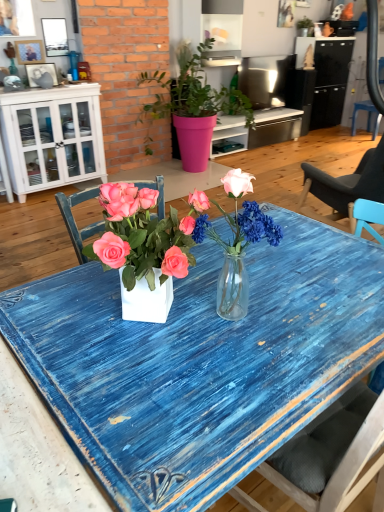
Describe the element at coordinates (193, 105) in the screenshot. I see `pink matte pot at center, which ranks as the 1th houseplant in front-to-back order` at that location.

Measure the distance between point (x=24, y=52) and camera.

Point (x=24, y=52) is 3.58 meters away from camera.

The height and width of the screenshot is (512, 384). What are the coordinates of `brushed metal picture frame at upper left, which is the third picture frame from bottom to top` in the screenshot? It's located at (55, 36).

The width and height of the screenshot is (384, 512). In order to click on blue plastic chair at right in this screenshot , I will do `click(367, 117)`.

From a real-world perspective, which is physically above, pink matte pot at center, which ranks as the 1th houseplant in front-to-back order, or green matte plant at upper center, placed as the first houseplant when sorted from right to left?

green matte plant at upper center, placed as the first houseplant when sorted from right to left, is physically above.

Is there a large distance between pink matte pot at center, the 2th houseplant when ordered from right to left, and green matte plant at upper center, which appears as the second houseplant when viewed from the front?

pink matte pot at center, the 2th houseplant when ordered from right to left, is positioned a significant distance from green matte plant at upper center, which appears as the second houseplant when viewed from the front.

Considering the sizes of objects pink matte pot at center, which ranks as the 1th houseplant in front-to-back order, and green matte plant at upper center, which ranks as the 1th houseplant in top-to-bottom order, in the image provided, who is wider, pink matte pot at center, which ranks as the 1th houseplant in front-to-back order, or green matte plant at upper center, which ranks as the 1th houseplant in top-to-bottom order,?

pink matte pot at center, which ranks as the 1th houseplant in front-to-back order, is wider.

Is matte black picture frame at upper left, acting as the first picture frame starting from the bottom, placed right next to white wood cabinet at left?

No, matte black picture frame at upper left, acting as the first picture frame starting from the bottom, is not touching white wood cabinet at left.

Is matte black picture frame at upper left, acting as the third picture frame starting from the top, facing away from white wood cabinet at left?

That's not correct — matte black picture frame at upper left, acting as the third picture frame starting from the top, is not looking away from white wood cabinet at left.

Which is behind, point (40, 70) or point (101, 148)?

The point (101, 148) is farther from the camera.

From their relative heights in the image, would you say green matte plant at upper center, positioned as the second houseplant in left-to-right order, is taller or shorter than translucent glass vase at center?

In the image, green matte plant at upper center, positioned as the second houseplant in left-to-right order, appears to be shorter than translucent glass vase at center.

Does green matte plant at upper center, the 2th houseplant from the bottom, have a greater width compared to translucent glass vase at center?

Yes.

Would you consider green matte plant at upper center, which ranks as the 1th houseplant in top-to-bottom order, to be distant from translucent glass vase at center?

Yes, green matte plant at upper center, which ranks as the 1th houseplant in top-to-bottom order, and translucent glass vase at center are quite far apart.

Does green matte plant at upper center, which appears as the second houseplant when viewed from the front, come behind translucent glass vase at center?

Yes.

The width and height of the screenshot is (384, 512). Find the location of `chair above the translucent glass vase at center (from the image's perspective)`. chair above the translucent glass vase at center (from the image's perspective) is located at coordinates (367, 117).

From the picture: In the image, is blue plastic chair at right positioned in front of or behind translucent glass vase at center?

blue plastic chair at right is behind translucent glass vase at center.

From a real-world perspective, which object stands above the other?

In real-world perspective, translucent glass vase at center is above.

Considering the relative positions of blue plastic chair at right and translucent glass vase at center in the image provided, is blue plastic chair at right to the right of translucent glass vase at center from the viewer's perspective?

Yes, blue plastic chair at right is to the right of translucent glass vase at center.

Does blue plastic chair at right have a larger size compared to wooden picture frame at upper left, placed as the second picture frame when sorted from top to bottom?

Correct, blue plastic chair at right is larger in size than wooden picture frame at upper left, placed as the second picture frame when sorted from top to bottom.

Is point (380, 76) less distant than point (18, 53)?

No.

Which object is closer to the camera taking this photo, blue plastic chair at right or wooden picture frame at upper left, placed as the second picture frame when sorted from top to bottom?

wooden picture frame at upper left, placed as the second picture frame when sorted from top to bottom.

From the image's perspective, starting from the blue plastic chair at right, which picture frame is the 2nd one below? Please provide its 2D coordinates.

[(29, 52)]

Who is smaller, white wood cabinet at left or pink matte pot at center, the first houseplant positioned from the left?

Smaller between the two is white wood cabinet at left.

From the image's perspective, relative to pink matte pot at center, the 2th houseplant when ordered from right to left, is white wood cabinet at left above or below?

Based on their image positions, white wood cabinet at left is located beneath pink matte pot at center, the 2th houseplant when ordered from right to left.

Considering the sizes of objects white wood cabinet at left and pink matte pot at center, positioned as the 2th houseplant in top-to-bottom order, in the image provided, who is shorter, white wood cabinet at left or pink matte pot at center, positioned as the 2th houseplant in top-to-bottom order,?

white wood cabinet at left is shorter.

Is the position of pink matte pot at center, positioned as the 2th houseplant in top-to-bottom order, less distant than that of matte black picture frame at upper left, acting as the third picture frame starting from the top?

Yes, pink matte pot at center, positioned as the 2th houseplant in top-to-bottom order, is closer to the viewer.

Is pink matte pot at center, which ranks as the 1th houseplant in front-to-back order, located outside matte black picture frame at upper left, acting as the third picture frame starting from the top?

pink matte pot at center, which ranks as the 1th houseplant in front-to-back order, lies outside matte black picture frame at upper left, acting as the third picture frame starting from the top,'s area.

From the image's perspective, is pink matte pot at center, the first houseplant positioned from the left, beneath matte black picture frame at upper left, acting as the third picture frame starting from the top?

Yes.

Find the location of `houseplant to the left of green matte plant at upper center, placed as the first houseplant when sorted from right to left`. houseplant to the left of green matte plant at upper center, placed as the first houseplant when sorted from right to left is located at coordinates (193, 105).

The width and height of the screenshot is (384, 512). Find the location of `picture frame that is the 1st one when counting upward from the white wood cabinet at left (from the image's perspective)`. picture frame that is the 1st one when counting upward from the white wood cabinet at left (from the image's perspective) is located at coordinates (40, 72).

Estimate the real-world distances between objects in this image. Which object is further from wooden picture frame at upper left, placed as the second picture frame when sorted from top to bottom, brushed metal picture frame at upper left, the 1th picture frame when ordered from top to bottom, or pink matte pot at center, the first houseplant positioned from the left?

Among the two, pink matte pot at center, the first houseplant positioned from the left, is located further to wooden picture frame at upper left, placed as the second picture frame when sorted from top to bottom.

Looking at the image, which one is located closer to blue distressed wood desk at center, matte black picture frame at upper left, acting as the third picture frame starting from the top, or white wood cabinet at left?

Among the two, white wood cabinet at left is located nearer to blue distressed wood desk at center.

Consider the image. Looking at the image, which one is located further to blue distressed wood desk at center, brushed metal picture frame at upper left, the 1th picture frame when ordered from top to bottom, or blue plastic chair at right?

The object further to blue distressed wood desk at center is blue plastic chair at right.

Looking at the image, which one is located closer to blue distressed wood desk at center, blue plastic chair at right or brushed metal picture frame at upper left, which is the third picture frame from bottom to top?

brushed metal picture frame at upper left, which is the third picture frame from bottom to top, lies closer to blue distressed wood desk at center than the other object.

Considering their positions, is blue distressed wood desk at center positioned closer to blue plastic chair at right than white wood cabinet at left?

white wood cabinet at left is closer to blue plastic chair at right.

Based on their spatial positions, is green matte plant at upper center, placed as the first houseplant when sorted from right to left, or white wood cabinet at left further from translucent glass vase at center?

The object further to translucent glass vase at center is green matte plant at upper center, placed as the first houseplant when sorted from right to left.

Based on their spatial positions, is translucent glass vase at center or pink matte pot at center, marked as the 1th houseplant in a bottom-to-top arrangement, closer to brushed metal picture frame at upper left, which is the third picture frame from bottom to top?

pink matte pot at center, marked as the 1th houseplant in a bottom-to-top arrangement, lies closer to brushed metal picture frame at upper left, which is the third picture frame from bottom to top, than the other object.

Based on their spatial positions, is blue plastic chair at right or wooden picture frame at upper left, placed as the second picture frame when sorted from top to bottom, closer to green matte plant at upper center, which appears as the second houseplant when viewed from the front?

blue plastic chair at right is closer to green matte plant at upper center, which appears as the second houseplant when viewed from the front.

Find the location of a particular element. houseplant between pink matte pot at center, the 2th houseplant when ordered from right to left, and blue plastic chair at right, in the horizontal direction is located at coordinates (305, 27).

Identify the location of houseplant located between wooden picture frame at upper left, placed as the second picture frame when sorted from top to bottom, and green matte plant at upper center, which appears as the second houseplant when viewed from the front, in the left-right direction. (193, 105).

Find the location of a particular element. The width and height of the screenshot is (384, 512). carnation between blue distressed wood desk at center and brushed metal picture frame at upper left, the 1th picture frame when ordered from top to bottom, along the z-axis is located at coordinates (237, 243).

The width and height of the screenshot is (384, 512). Identify the location of picture frame located between blue distressed wood desk at center and wooden picture frame at upper left, placed as the second picture frame when sorted from bottom to top, in the depth direction. (x=40, y=72).